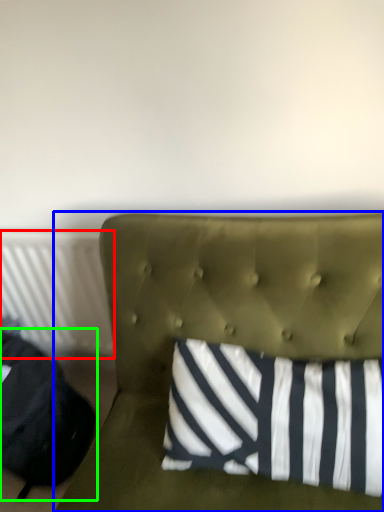
Question: Which is farther away from radiator (highlighted by a red box)? furniture (highlighted by a blue box) or bean bag chair (highlighted by a green box)?

Choices:
 (A) furniture
 (B) bean bag chair

Answer: (A)